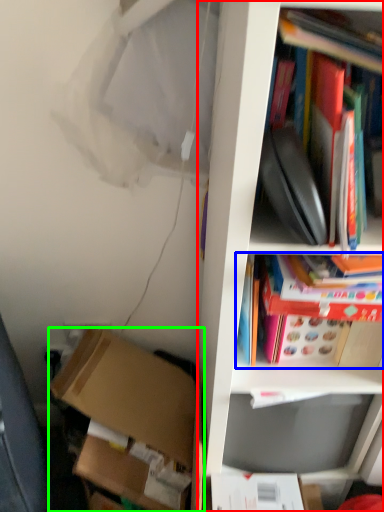
Question: Considering the real-world distances, which object is farthest from cabinetry (highlighted by a red box)? book (highlighted by a blue box) or box (highlighted by a green box)?

Choices:
 (A) book
 (B) box

Answer: (B)